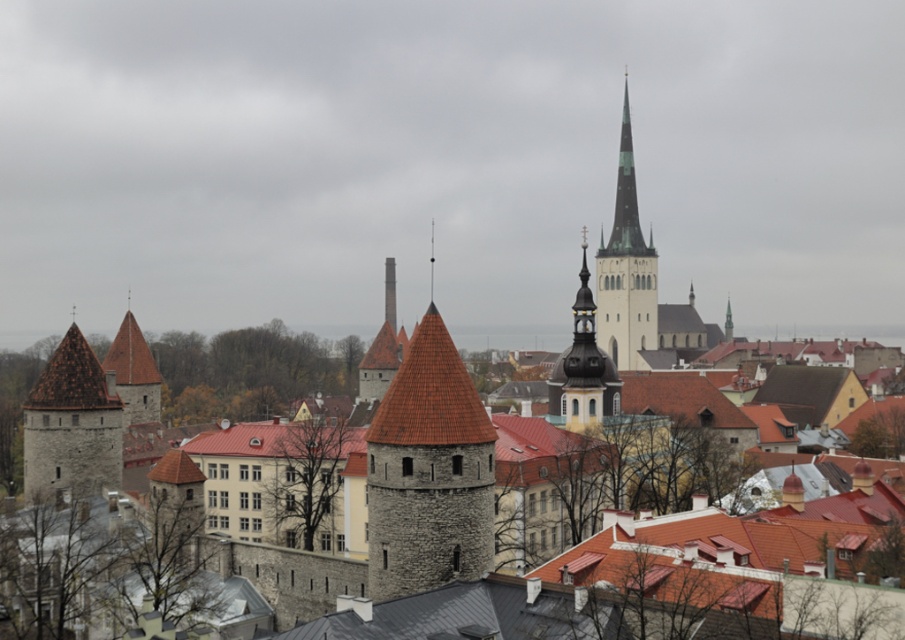
Question: Can you confirm if stone brick tower at left is positioned to the right of greenish-gray stone spire at center-right?

Choices:
 (A) no
 (B) yes

Answer: (A)

Question: Is greenish-gray stone spire at center-right above gold textured spire at center?

Choices:
 (A) yes
 (B) no

Answer: (A)

Question: Among these points, which one is nearest to the camera?

Choices:
 (A) (627, 301)
 (B) (551, 387)

Answer: (B)

Question: Which point is farther to the camera?

Choices:
 (A) stone brick tower at left
 (B) gold textured spire at center

Answer: (B)

Question: Observing the image, what is the correct spatial positioning of greenish-gray stone spire at center-right in reference to gold textured spire at center?

Choices:
 (A) above
 (B) below

Answer: (A)

Question: Which of these objects is positioned closest to the greenish-gray stone spire at center-right?

Choices:
 (A) stone brick tower at left
 (B) gold textured spire at center

Answer: (B)